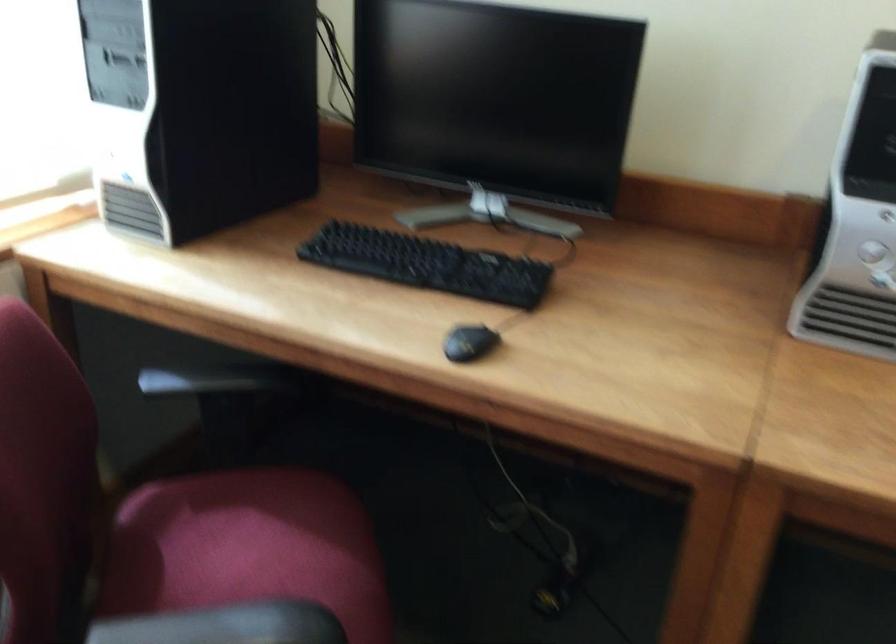
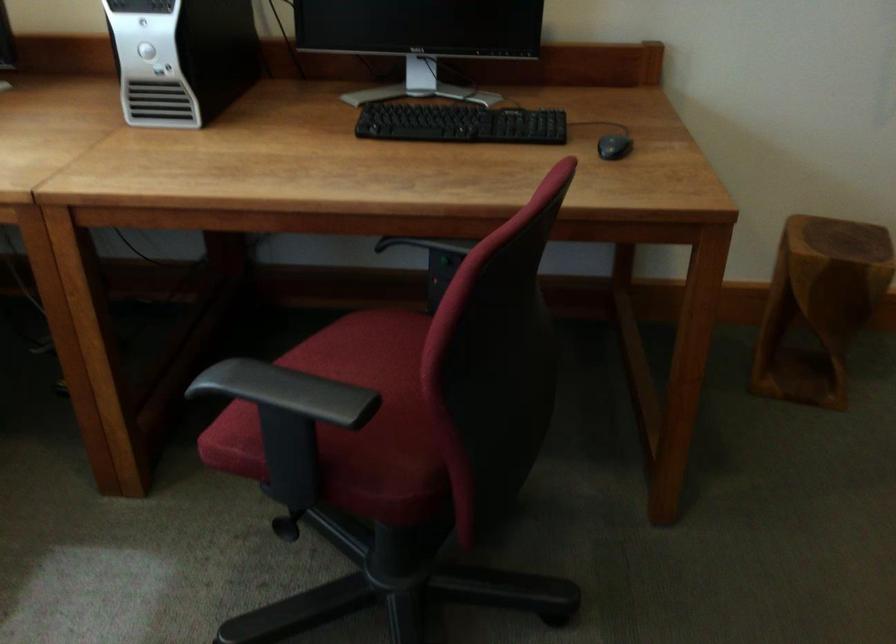
Which direction would the cameraman need to move to produce the second image?

The movement direction of the cameraman is right, backward.